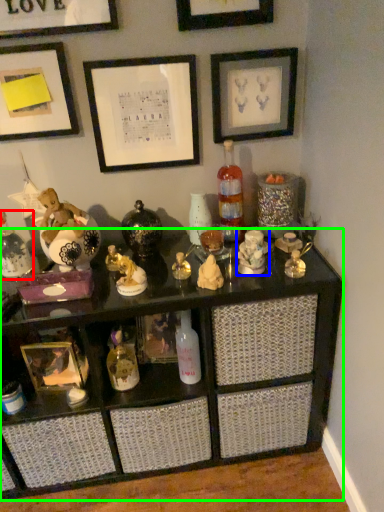
Question: Estimate the real-world distances between objects in this image. Which object is farther from bottle (highlighted by a red box), toy (highlighted by a blue box) or shelf (highlighted by a green box)?

Choices:
 (A) toy
 (B) shelf

Answer: (A)